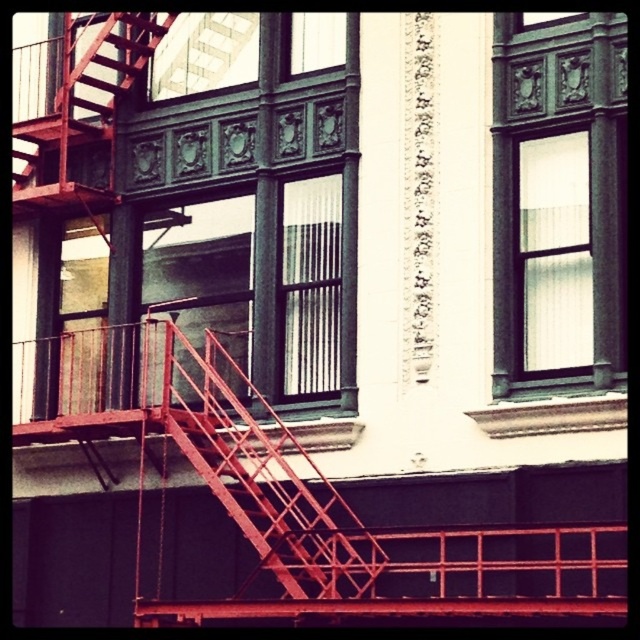
Is metallic red fire escape at center below clear glass window at upper right?

Indeed, metallic red fire escape at center is positioned under clear glass window at upper right.

Between metallic red fire escape at center and clear glass window at upper right, which one has more height?

metallic red fire escape at center

Measure the distance between metallic red fire escape at center and camera.

metallic red fire escape at center is 44.84 meters from camera.

Where is `metallic red fire escape at center`? metallic red fire escape at center is located at coordinates (264, 477).

Can you confirm if clear glass window at upper right is thinner than clear glass window at upper center?

Indeed, clear glass window at upper right has a lesser width compared to clear glass window at upper center.

Can you confirm if clear glass window at upper right is positioned below clear glass window at upper center?

Indeed, clear glass window at upper right is positioned under clear glass window at upper center.

You are a GUI agent. You are given a task and a screenshot of the screen. Output one action in this format:
    pyautogui.click(x=<x>, y=<y>)
    Task: Click on the clear glass window at upper right
    
    Given the screenshot: What is the action you would take?
    pyautogui.click(x=554, y=253)

Locate an element on the screen. clear glass window at upper right is located at coordinates (554, 253).

Measure the distance from metallic red fire escape at center to clear glass window at upper center.

metallic red fire escape at center and clear glass window at upper center are 39.40 feet apart from each other.

Is metallic red fire escape at center smaller than clear glass window at upper center?

Incorrect, metallic red fire escape at center is not smaller in size than clear glass window at upper center.

Measure the distance between metallic red fire escape at center and camera.

metallic red fire escape at center is 147.11 feet from camera.

What are the coordinates of `metallic red fire escape at center` in the screenshot? It's located at 264,477.